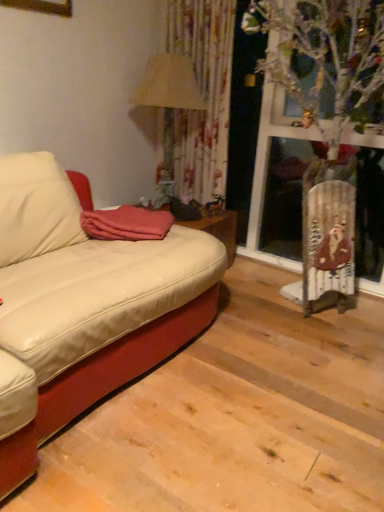
Question: Does beige fabric lampshade at upper center have a greater width compared to coral fleece blanket at center?

Choices:
 (A) no
 (B) yes

Answer: (A)

Question: Does beige fabric lampshade at upper center have a greater height compared to coral fleece blanket at center?

Choices:
 (A) no
 (B) yes

Answer: (B)

Question: From the image's perspective, is beige fabric lampshade at upper center under coral fleece blanket at center?

Choices:
 (A) yes
 (B) no

Answer: (B)

Question: Is beige fabric lampshade at upper center positioned before coral fleece blanket at center?

Choices:
 (A) yes
 (B) no

Answer: (B)

Question: Could you tell me if beige fabric lampshade at upper center is turned towards coral fleece blanket at center?

Choices:
 (A) yes
 (B) no

Answer: (B)

Question: Can you confirm if beige fabric lampshade at upper center is shorter than coral fleece blanket at center?

Choices:
 (A) yes
 (B) no

Answer: (B)

Question: From a real-world perspective, is coral fleece blanket at center under beige fabric lampshade at upper center?

Choices:
 (A) no
 (B) yes

Answer: (B)

Question: From a real-world perspective, is coral fleece blanket at center over beige fabric lampshade at upper center?

Choices:
 (A) no
 (B) yes

Answer: (A)

Question: Is coral fleece blanket at center further to the viewer compared to beige fabric lampshade at upper center?

Choices:
 (A) yes
 (B) no

Answer: (B)

Question: From the image's perspective, is coral fleece blanket at center beneath beige fabric lampshade at upper center?

Choices:
 (A) no
 (B) yes

Answer: (B)

Question: Does coral fleece blanket at center come in front of beige fabric lampshade at upper center?

Choices:
 (A) no
 (B) yes

Answer: (B)

Question: Can beige fabric lampshade at upper center be found inside coral fleece blanket at center?

Choices:
 (A) yes
 (B) no

Answer: (B)

Question: From the image's perspective, is coral fleece blanket at center above or below beige fabric lampshade at upper center?

Choices:
 (A) above
 (B) below

Answer: (B)